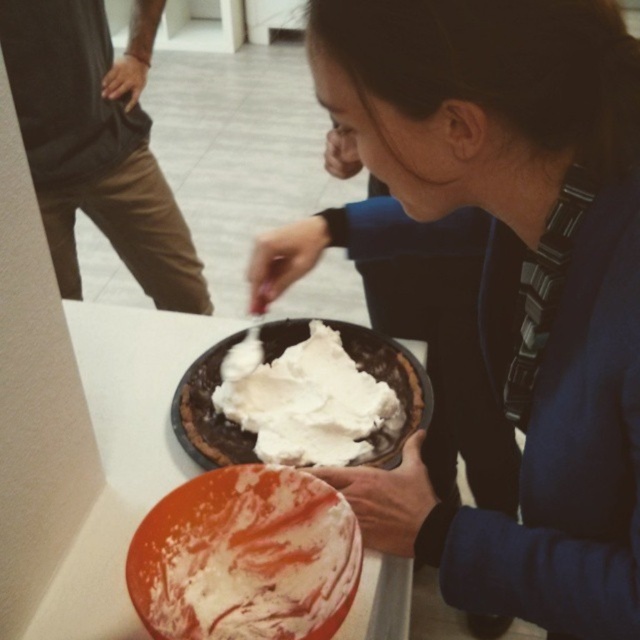
Based on the photo, you are a baker who needs to place a decorative cake topper on the highest point of the cake. Given the white creamy cake at lower center and the white fluffy frosting at center, which one should you place the topper on?

The white fluffy frosting at center is the highest point since it is located above the white creamy cake at lower center, so place the topper there.

You are a baker trying to decide where to place a new ingredient container. The container is 30 cm wide. You see the brown cotton pants at left and the white fluffy frosting at center. Which object has enough space next to it to fit the container without overlapping?

The brown cotton pants at left has a width larger than the white fluffy frosting at center, so the container can be placed next to the brown cotton pants at left since it has more space.